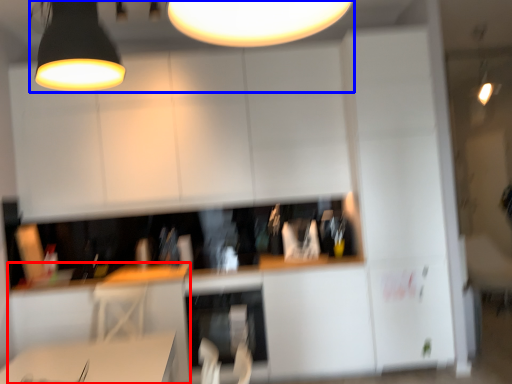
Question: Which point is closer to the camera, computer desk (highlighted by a red box) or lamp (highlighted by a blue box)?

Choices:
 (A) computer desk
 (B) lamp

Answer: (A)